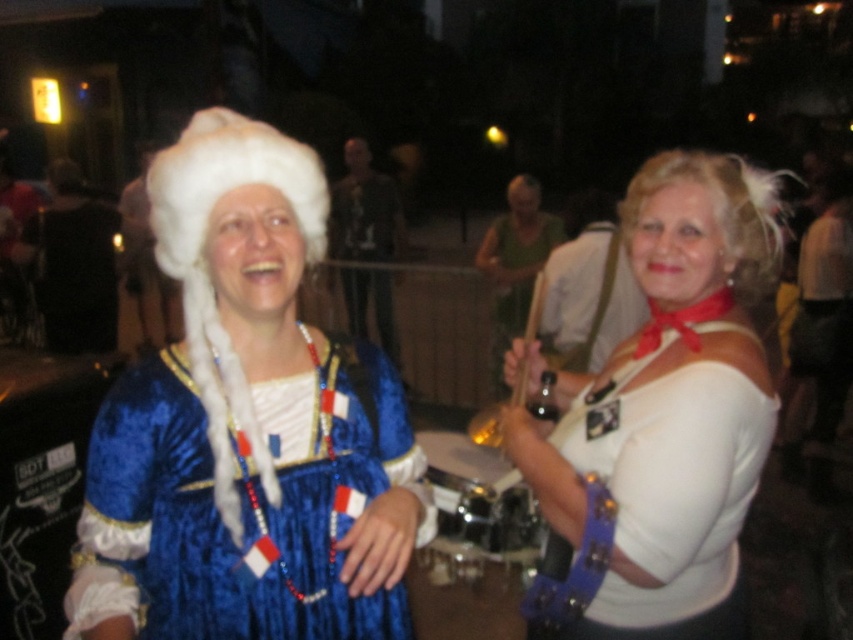
You are at a costume party and see two people. One is wearing a white fluffy wig at upper left and the other has a white matte shirt at center. Which person is positioned to the right of the other?

The white matte shirt at center is to the right of the white fluffy wig at upper left.

You are a photographer at the event and need to position the two subjects so that their main features are clearly visible. Given the white fluffy wig at upper left and the white matte shirt at center, which object should be placed closer to the camera to ensure it appears larger in the photo?

The white fluffy wig at upper left should be placed closer to the camera because objects closer to the camera appear larger, and since the white matte shirt at center is already taller than the white fluffy wig at upper left in the current image, moving the wig closer would make it appear larger relative to the shirt.